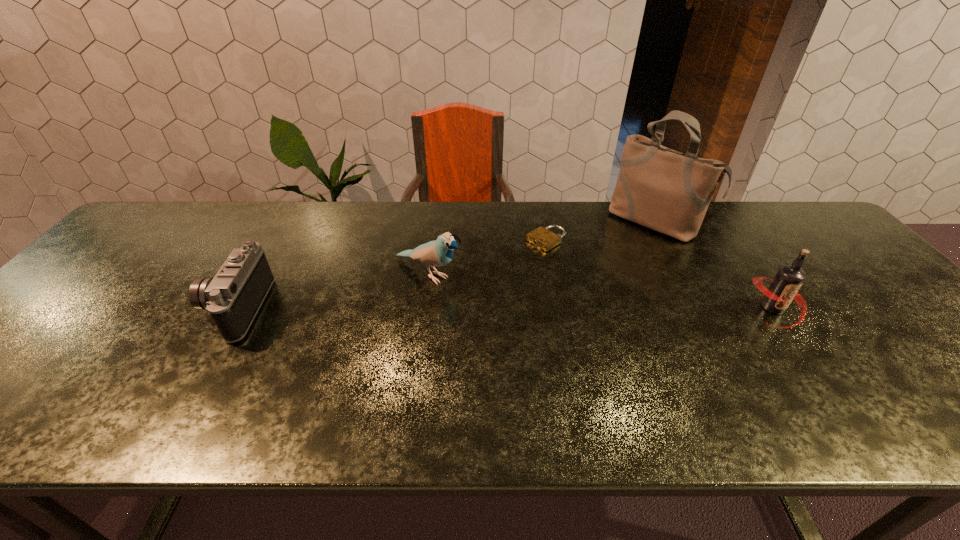
Find the location of a particular element. object identified as the second closest to the second shortest object is located at coordinates (544, 239).

In order to click on vacant space that satisfies the following two spatial constraints: 1. on the back side of the tallest object; 2. on the right side of the bird in this screenshot , I will do `click(436, 221)`.

Where is `vacant area that satisfies the following two spatial constraints: 1. on the back side of the shortest object; 2. on the right side of the shoulder bag`? The width and height of the screenshot is (960, 540). vacant area that satisfies the following two spatial constraints: 1. on the back side of the shortest object; 2. on the right side of the shoulder bag is located at coordinates (542, 221).